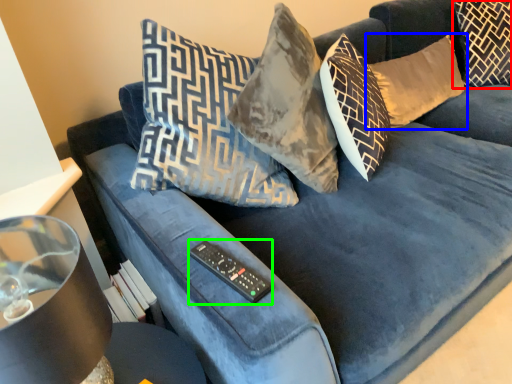
Question: Based on their relative distances, which object is nearer to pillow (highlighted by a red box)? Choose from pillow (highlighted by a blue box) and remote (highlighted by a green box).

Choices:
 (A) pillow
 (B) remote

Answer: (A)